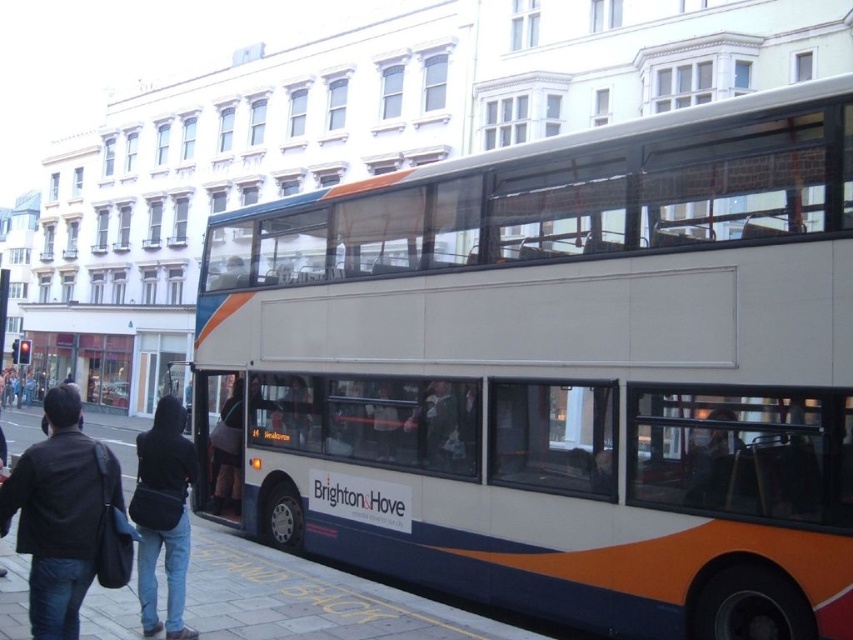
The width and height of the screenshot is (853, 640). Find the location of `white glossy bus at center`. white glossy bus at center is located at coordinates click(x=556, y=372).

You are a GUI agent. You are given a task and a screenshot of the screen. Output one action in this format:
    pyautogui.click(x=<x>, y=<y>)
    Task: Click on the white glossy bus at center
    The height and width of the screenshot is (640, 853).
    Given the screenshot: What is the action you would take?
    pyautogui.click(x=556, y=372)

I want to click on white glossy bus at center, so click(556, 372).

Does point (276, 452) lie in front of point (94, 589)?

No, (276, 452) is behind (94, 589).

Is point (262, 404) positioned behind point (125, 632)?

Yes, point (262, 404) is farther from viewer.

Is point (412, 372) more distant than point (399, 593)?

Yes, point (412, 372) is farther from viewer.

In order to click on white glossy bus at center in this screenshot , I will do `click(556, 372)`.

Does black leather jacket at lower left have a lesser height compared to black fabric bag at lower left?

No.

Does black leather jacket at lower left have a larger size compared to black fabric bag at lower left?

Indeed, black leather jacket at lower left has a larger size compared to black fabric bag at lower left.

Is point (61, 614) positioned in front of point (181, 451)?

Yes, it is in front of point (181, 451).

At what (x,y) coordinates should I click in order to perform the action: click on black leather jacket at lower left. Please return your answer as a coordinate pair (x, y). This screenshot has width=853, height=640. Looking at the image, I should click on (59, 515).